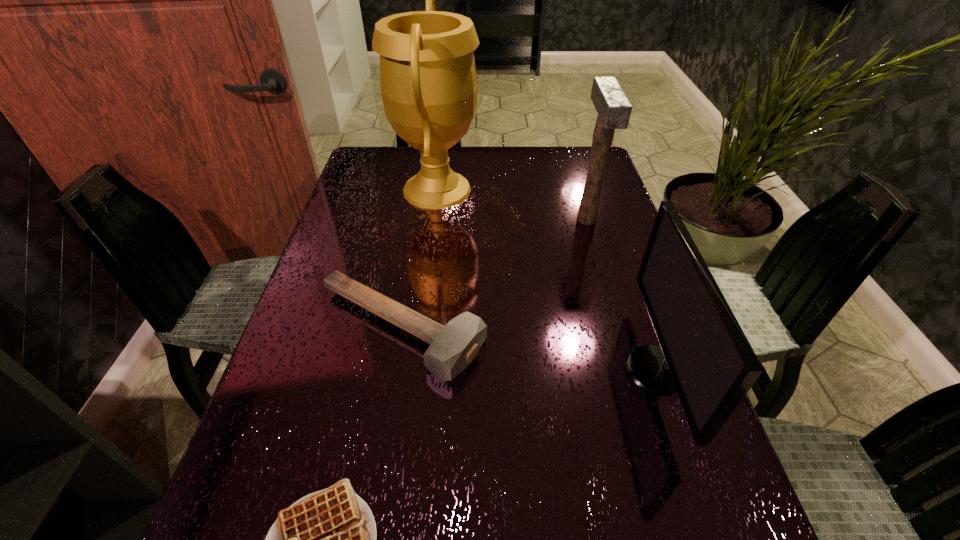
This screenshot has width=960, height=540. I want to click on the tallest object, so [x=428, y=81].

At what (x,y) coordinates should I click in order to perform the action: click on the second tallest object. Please return your answer as a coordinate pair (x, y). Looking at the image, I should click on (614, 110).

This screenshot has height=540, width=960. I want to click on the taller mallet, so click(614, 110).

Where is `the third tallest object`? The height and width of the screenshot is (540, 960). the third tallest object is located at coordinates (704, 355).

Find the location of `the left mallet`. the left mallet is located at coordinates (452, 347).

The image size is (960, 540). I want to click on the second shortest object, so click(452, 347).

This screenshot has width=960, height=540. What are the coordinates of `vacant space situated 0.290m on the engravings side of the tallest object` in the screenshot? It's located at (578, 190).

This screenshot has height=540, width=960. I want to click on free region located 0.330m on the left of the farther mallet, so click(456, 219).

Find the location of a particular element. free spot located on the front-facing side of the third shortest object is located at coordinates (465, 369).

I want to click on free spot located on the front-facing side of the third shortest object, so click(x=579, y=369).